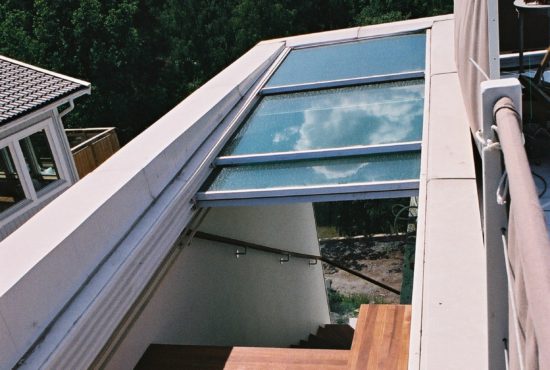
I want to click on table, so click(537, 4).